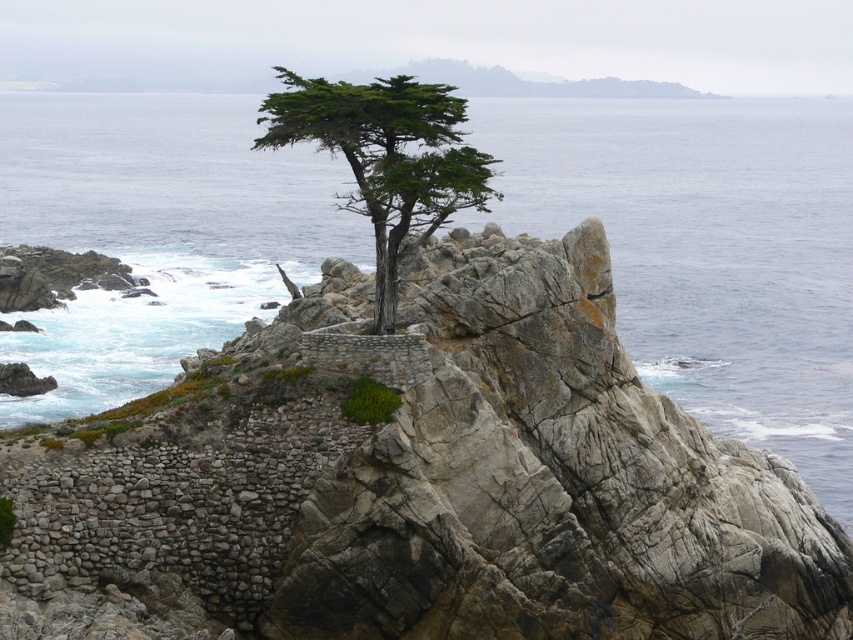
Question: Which object appears closest to the camera in this image?

Choices:
 (A) blue water at upper center
 (B) green textured tree at center

Answer: (B)

Question: Observing the image, what is the correct spatial positioning of blue water at upper center in reference to green textured tree at center?

Choices:
 (A) right
 (B) left

Answer: (B)

Question: Which point is farther from the camera taking this photo?

Choices:
 (A) (838, 445)
 (B) (415, 138)

Answer: (A)

Question: Is blue water at upper center thinner than green textured tree at center?

Choices:
 (A) yes
 (B) no

Answer: (B)

Question: Does blue water at upper center have a smaller size compared to green textured tree at center?

Choices:
 (A) no
 (B) yes

Answer: (A)